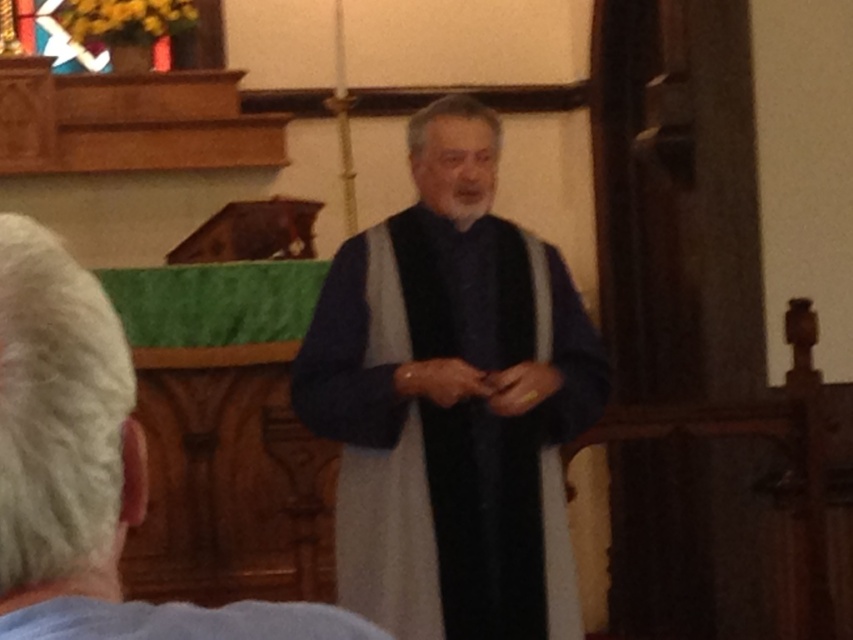
Can you confirm if velvet blue robe at center is thinner than dark blue fabric at center?

No.

Measure the distance between velvet blue robe at center and camera.

velvet blue robe at center is 13.30 feet from camera.

Describe the element at coordinates (451, 401) in the screenshot. I see `velvet blue robe at center` at that location.

The image size is (853, 640). What are the coordinates of `velvet blue robe at center` in the screenshot? It's located at (451, 401).